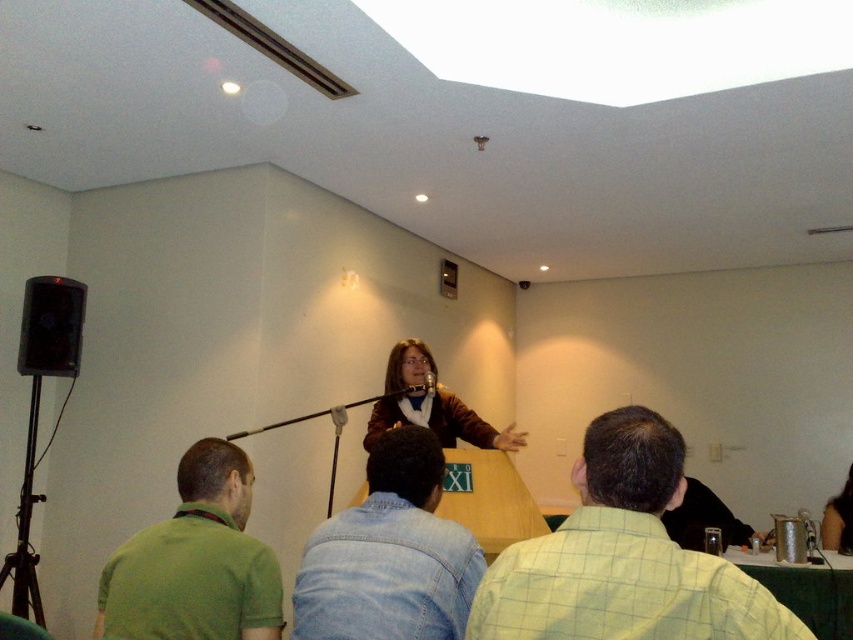
Based on the photo, you are standing at the entrance of the room and want to approach the speaker. There is a denim jacket at lower center in your way. Where should you walk around it to reach the speaker?

Since the denim jacket at lower center is located at point (389,554), you should walk around it to the left side to reach the speaker.

You are standing at the point marked by the coordinates point (389, 554) in the room. Looking around, you see the denim jacket at lower center. Which direction should you move to face the speaker who is standing behind the audience?

The speaker is behind the audience, so facing away from the denim jacket at lower center would orient you towards the speaker.

You are the speaker standing behind the podium. You want to gesture to the denim jacket at lower center and the metallic silver microphone at center. Which object is closer to your left side?

The denim jacket at lower center is to the left of the metallic silver microphone at center, so the denim jacket at lower center is closer to your left side.